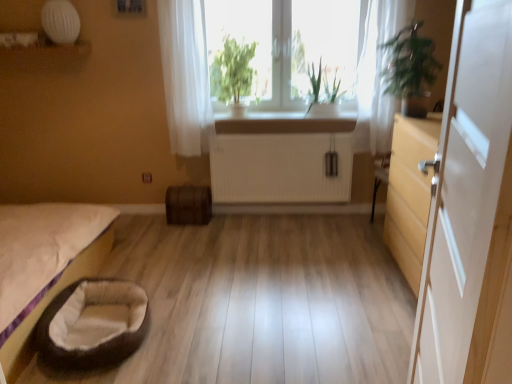
The height and width of the screenshot is (384, 512). Find the location of `white sheer curtain at upper right, which is the 1th curtain from right to left`. white sheer curtain at upper right, which is the 1th curtain from right to left is located at coordinates (381, 109).

What do you see at coordinates (186, 75) in the screenshot? The height and width of the screenshot is (384, 512). I see `white sheer curtain at upper center, placed as the 2th curtain when sorted from right to left` at bounding box center [186, 75].

What is the approximate width of green leafy plant at right?

It is 37.11 centimeters.

The image size is (512, 384). What do you see at coordinates (80, 317) in the screenshot?
I see `brown plush infant bed at lower left` at bounding box center [80, 317].

Describe the element at coordinates (314, 83) in the screenshot. I see `green matte plant at center, the 2th plant from the left` at that location.

At what (x,y) coordinates should I click in order to perform the action: click on white ribbed radiator at center. Please return your answer as a coordinate pair (x, y). This screenshot has width=512, height=384. Looking at the image, I should click on (280, 168).

Identify the location of white sheer curtain at upper right, which is the second curtain from left to right. (381, 109).

Is white ribbed radiator at center a part of white sheer curtain at upper right, which is the second curtain from left to right?

No.

Starting from the white ribbed radiator at center, which curtain is the 2nd one in front? Please provide its 2D coordinates.

[(381, 109)]

Who is bigger, white sheer curtain at upper right, which is the 1th curtain from right to left, or white ribbed radiator at center?

Bigger between the two is white ribbed radiator at center.

Which of these two, green matte plant at center, the 2th plant from the left, or white ribbed radiator at center, stands shorter?

green matte plant at center, the 2th plant from the left.

The width and height of the screenshot is (512, 384). What are the coordinates of `plant on the right of white ribbed radiator at center` in the screenshot? It's located at (x=314, y=83).

Looking at this image, is green matte plant at center, which is the 1th plant from right to left, located outside white ribbed radiator at center?

Yes.

From the image's perspective, is white sheer curtain at upper right, which is the 1th curtain from right to left, on top of beige fabric pet bed at lower left?

Yes, from the image's perspective, white sheer curtain at upper right, which is the 1th curtain from right to left, is above beige fabric pet bed at lower left.

Is white sheer curtain at upper right, which is the second curtain from left to right, in contact with beige fabric pet bed at lower left?

No, white sheer curtain at upper right, which is the second curtain from left to right, is not in contact with beige fabric pet bed at lower left.

Consider the image. How distant is white sheer curtain at upper right, which is the 1th curtain from right to left, from beige fabric pet bed at lower left?

8.03 feet.

Based on the photo, which is closer to the camera, (x=406, y=15) or (x=44, y=242)?

Point (x=406, y=15) is positioned farther from the camera compared to point (x=44, y=242).

Is white plastic window frame at center taller or shorter than beige fabric pet bed at lower left?

In the image, white plastic window frame at center appears to be taller than beige fabric pet bed at lower left.

From a real-world perspective, which object rests below the other?

beige fabric pet bed at lower left.

Is white plastic window frame at center inside or outside of beige fabric pet bed at lower left?

white plastic window frame at center exists outside the volume of beige fabric pet bed at lower left.

Is white plastic window frame at center to the left or to the right of beige fabric pet bed at lower left in the image?

white plastic window frame at center is to the right of beige fabric pet bed at lower left.

From a real-world perspective, is white sheer curtain at upper center, placed as the 2th curtain when sorted from right to left, positioned under white ribbed radiator at center based on gravity?

Incorrect, from a real-world perspective, white sheer curtain at upper center, placed as the 2th curtain when sorted from right to left, is higher than white ribbed radiator at center.

Based on the photo, would you consider white sheer curtain at upper center, the first curtain from the left, to be distant from white ribbed radiator at center?

No.

Is white sheer curtain at upper center, the first curtain from the left, thinner than white ribbed radiator at center?

Incorrect, the width of white sheer curtain at upper center, the first curtain from the left, is not less than that of white ribbed radiator at center.

From the image's perspective, which is above, white sheer curtain at upper center, the first curtain from the left, or white ribbed radiator at center?

white sheer curtain at upper center, the first curtain from the left, appears higher in the image.

In terms of height, does beige fabric pet bed at lower left look taller or shorter compared to green leafy plant at center, placed as the 2th plant when sorted from right to left?

beige fabric pet bed at lower left is taller than green leafy plant at center, placed as the 2th plant when sorted from right to left.

From a real-world perspective, is beige fabric pet bed at lower left below green leafy plant at center, placed as the 2th plant when sorted from right to left?

Yes, from a real-world perspective, beige fabric pet bed at lower left is beneath green leafy plant at center, placed as the 2th plant when sorted from right to left.

Considering the sizes of objects beige fabric pet bed at lower left and green leafy plant at center, positioned as the first plant in left-to-right order, in the image provided, who is bigger, beige fabric pet bed at lower left or green leafy plant at center, positioned as the first plant in left-to-right order,?

beige fabric pet bed at lower left is bigger.

Is beige fabric pet bed at lower left far away from green leafy plant at center, placed as the 2th plant when sorted from right to left?

beige fabric pet bed at lower left is positioned a significant distance from green leafy plant at center, placed as the 2th plant when sorted from right to left.

From the image's perspective, is white plastic window frame at center above or below white glossy door at right?

Clearly, from the image's perspective, white plastic window frame at center is above white glossy door at right.

Does white plastic window frame at center have a lesser width compared to white glossy door at right?

Yes.

Locate an element on the screen. The width and height of the screenshot is (512, 384). door in front of the white plastic window frame at center is located at coordinates (471, 213).

Can you tell me how much white plastic window frame at center and white glossy door at right differ in facing direction?

The angle between the facing direction of white plastic window frame at center and the facing direction of white glossy door at right is 104 degrees.

Where is `radiator below the white sheer curtain at upper right, which is the 1th curtain from right to left (from a real-world perspective)`? radiator below the white sheer curtain at upper right, which is the 1th curtain from right to left (from a real-world perspective) is located at coordinates (280, 168).

Locate an element on the screen. radiator behind the green matte plant at center, which is the 1th plant from right to left is located at coordinates (280, 168).

Estimate the real-world distances between objects in this image. Which object is closer to green leafy plant at right, white sheer curtain at upper right, which is the second curtain from left to right, or green matte plant at center, the 2th plant from the left?

Among the two, white sheer curtain at upper right, which is the second curtain from left to right, is located nearer to green leafy plant at right.

Based on the photo, which object lies further to the anchor point green leafy plant at right, white plastic window frame at center or white sheer curtain at upper right, which is the 1th curtain from right to left?

Based on the image, white plastic window frame at center appears to be further to green leafy plant at right.

Considering their positions, is white sheer curtain at upper center, placed as the 2th curtain when sorted from right to left, positioned closer to green matte plant at center, the 2th plant from the left, than beige fabric pet bed at lower left?

Based on the image, white sheer curtain at upper center, placed as the 2th curtain when sorted from right to left, appears to be nearer to green matte plant at center, the 2th plant from the left.

From the image, which object appears to be nearer to white plastic window frame at center, green leafy plant at right or green leafy plant at center, placed as the 2th plant when sorted from right to left?

green leafy plant at center, placed as the 2th plant when sorted from right to left, is closer to white plastic window frame at center.

Considering their positions, is green leafy plant at right positioned closer to beige fabric pet bed at lower left than white sheer curtain at upper center, placed as the 2th curtain when sorted from right to left?

Among the two, white sheer curtain at upper center, placed as the 2th curtain when sorted from right to left, is located nearer to beige fabric pet bed at lower left.

From the image, which object appears to be farther from white ribbed radiator at center, white glossy door at right or white glossy counter top at center?

Among the two, white glossy door at right is located further to white ribbed radiator at center.

From the image, which object appears to be nearer to green matte plant at center, the 2th plant from the left, white plastic window frame at center or white glossy counter top at center?

white glossy counter top at center is positioned closer to the anchor green matte plant at center, the 2th plant from the left.

Considering their positions, is white glossy door at right positioned further to green leafy plant at right than white sheer curtain at upper center, the first curtain from the left?

Based on the image, white glossy door at right appears to be further to green leafy plant at right.

The image size is (512, 384). I want to click on plant between white glossy door at right and green matte plant at center, which is the 1th plant from right to left, in the front-back direction, so click(232, 70).

Identify the location of counter top between white sheer curtain at upper center, the first curtain from the left, and green matte plant at center, the 2th plant from the left, in the horizontal direction. (284, 123).

Identify the location of radiator between white sheer curtain at upper center, placed as the 2th curtain when sorted from right to left, and white glossy counter top at center. (280, 168).

Locate an element on the screen. The width and height of the screenshot is (512, 384). radiator located between white sheer curtain at upper center, the first curtain from the left, and green matte plant at center, the 2th plant from the left, in the left-right direction is located at coordinates (280, 168).